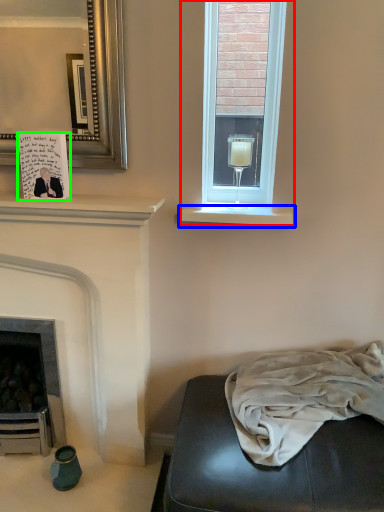
Question: Which is nearer to the window (highlighted by a red box)? window sill (highlighted by a blue box) or postcard (highlighted by a green box).

Choices:
 (A) window sill
 (B) postcard

Answer: (A)